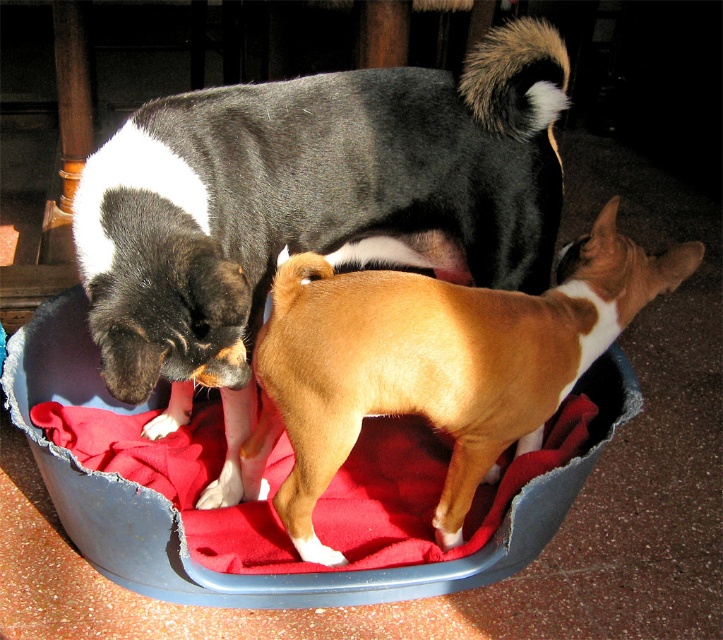
Question: Among these points, which one is nearest to the camera?

Choices:
 (A) (620, 406)
 (B) (231, 406)
 (C) (278, 304)

Answer: (C)

Question: Which point is closer to the camera?

Choices:
 (A) black and white fur at upper left
 (B) blue fabric dog bed at center
 (C) brown smooth dog at center

Answer: (A)

Question: Can you confirm if brown smooth dog at center is positioned to the right of blue fabric dog bed at center?

Choices:
 (A) yes
 (B) no

Answer: (A)

Question: Which point appears farthest from the camera in this image?

Choices:
 (A) tap(61, 388)
 (B) tap(80, 189)
 (C) tap(534, 445)

Answer: (A)

Question: Can you confirm if brown smooth dog at center is bigger than blue fabric dog bed at center?

Choices:
 (A) yes
 (B) no

Answer: (B)

Question: Is brown smooth dog at center thinner than blue fabric dog bed at center?

Choices:
 (A) yes
 (B) no

Answer: (A)